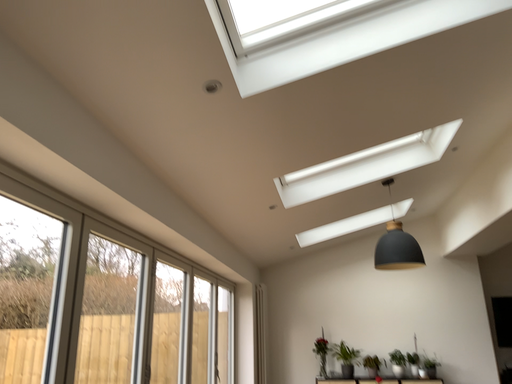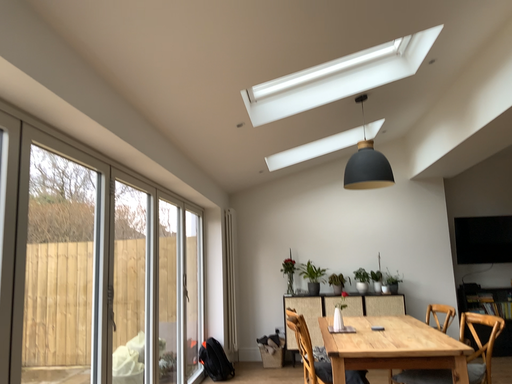
Question: How did the camera likely rotate when shooting the video?

Choices:
 (A) rotated downward
 (B) rotated upward

Answer: (A)